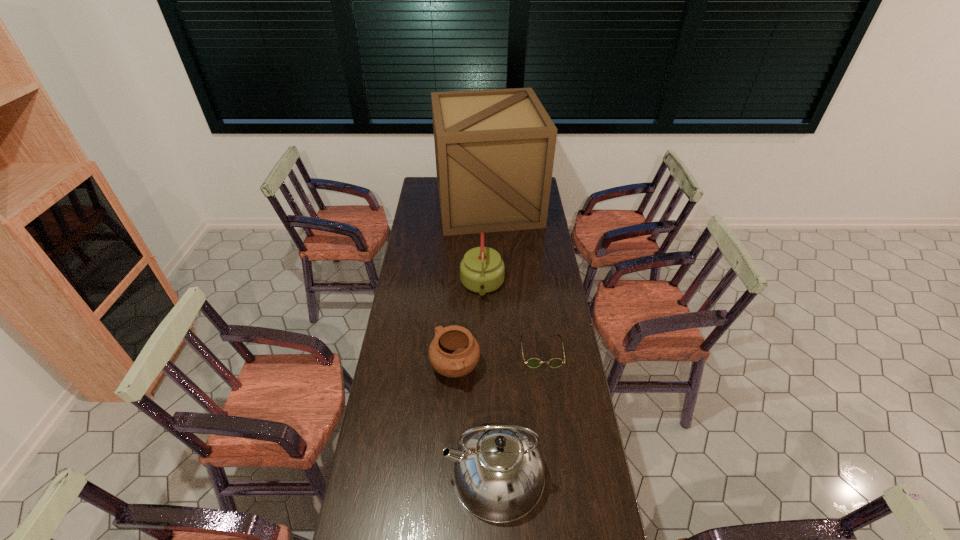
This screenshot has height=540, width=960. What are the coordinates of `free space located 0.190m from the spout of the taller kettle` in the screenshot? It's located at (385, 474).

The width and height of the screenshot is (960, 540). Find the location of `free location located from the spout of the taller kettle`. free location located from the spout of the taller kettle is located at coordinates (370, 474).

Locate an element on the screen. The width and height of the screenshot is (960, 540). blank space located at the spout of the farther kettle is located at coordinates tap(483, 325).

The height and width of the screenshot is (540, 960). In order to click on blank space located 0.110m on the back of the pottery in this screenshot , I will do `click(457, 327)`.

Image resolution: width=960 pixels, height=540 pixels. Identify the location of vacant space located 0.280m on the lenses of the shortest object. (553, 436).

Locate an element on the screen. Image resolution: width=960 pixels, height=540 pixels. object at the far edge is located at coordinates coord(494,149).

Find the location of a particular element. Image resolution: width=960 pixels, height=540 pixels. object present at the left edge is located at coordinates (494, 149).

Locate an element on the screen. The width and height of the screenshot is (960, 540). box situated at the right edge is located at coordinates (494, 149).

Identify the location of spectacles situated at the right edge. (533, 362).

The image size is (960, 540). What are the coordinates of `object that is at the far left corner` in the screenshot? It's located at (494, 149).